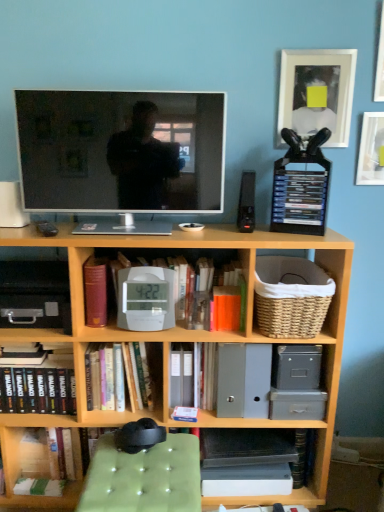
Question: Does orange matte paperback book at center, which is counted as the first paperback book, starting from the right, have a greater height compared to white plastic alarm clock at center?

Choices:
 (A) yes
 (B) no

Answer: (B)

Question: From a real-world perspective, is orange matte paperback book at center, which is counted as the second paperback book, starting from the left, located beneath white plastic alarm clock at center?

Choices:
 (A) no
 (B) yes

Answer: (B)

Question: Is orange matte paperback book at center, which is counted as the second paperback book, starting from the left, positioned behind white plastic alarm clock at center?

Choices:
 (A) no
 (B) yes

Answer: (B)

Question: Is orange matte paperback book at center, which is counted as the second paperback book, starting from the left, positioned in front of white plastic alarm clock at center?

Choices:
 (A) yes
 (B) no

Answer: (B)

Question: Is orange matte paperback book at center, which is counted as the second paperback book, starting from the left, wider than white plastic alarm clock at center?

Choices:
 (A) yes
 (B) no

Answer: (A)

Question: From a real-world perspective, is wooden bookcase at center positioned above or below matte black tv at center?

Choices:
 (A) below
 (B) above

Answer: (A)

Question: Considering the positions of wooden bookcase at center and matte black tv at center in the image, is wooden bookcase at center taller or shorter than matte black tv at center?

Choices:
 (A) tall
 (B) short

Answer: (A)

Question: Would you say wooden bookcase at center is to the left or to the right of matte black tv at center in the picture?

Choices:
 (A) right
 (B) left

Answer: (A)

Question: Is wooden bookcase at center inside or outside of matte black tv at center?

Choices:
 (A) outside
 (B) inside

Answer: (A)

Question: Considering the relative positions of black plastic drawer at left and orange matte paperback book at center, which is counted as the first paperback book, starting from the right, in the image provided, is black plastic drawer at left to the left or to the right of orange matte paperback book at center, which is counted as the first paperback book, starting from the right,?

Choices:
 (A) left
 (B) right

Answer: (A)

Question: From a real-world perspective, is black plastic drawer at left physically located above or below orange matte paperback book at center, which is counted as the first paperback book, starting from the right?

Choices:
 (A) below
 (B) above

Answer: (B)

Question: Considering their positions, is black plastic drawer at left located in front of or behind orange matte paperback book at center, which is counted as the first paperback book, starting from the right?

Choices:
 (A) behind
 (B) front

Answer: (B)

Question: Considering the positions of black plastic drawer at left and orange matte paperback book at center, which is counted as the first paperback book, starting from the right, in the image, is black plastic drawer at left taller or shorter than orange matte paperback book at center, which is counted as the first paperback book, starting from the right,?

Choices:
 (A) tall
 (B) short

Answer: (A)

Question: Is point (145, 270) positioned closer to the camera than point (329, 57)?

Choices:
 (A) farther
 (B) closer

Answer: (B)

Question: Based on their sizes in the image, would you say white plastic alarm clock at center is bigger or smaller than white glossy picture frame at upper right, placed as the third picture frame when sorted from right to left?

Choices:
 (A) big
 (B) small

Answer: (A)